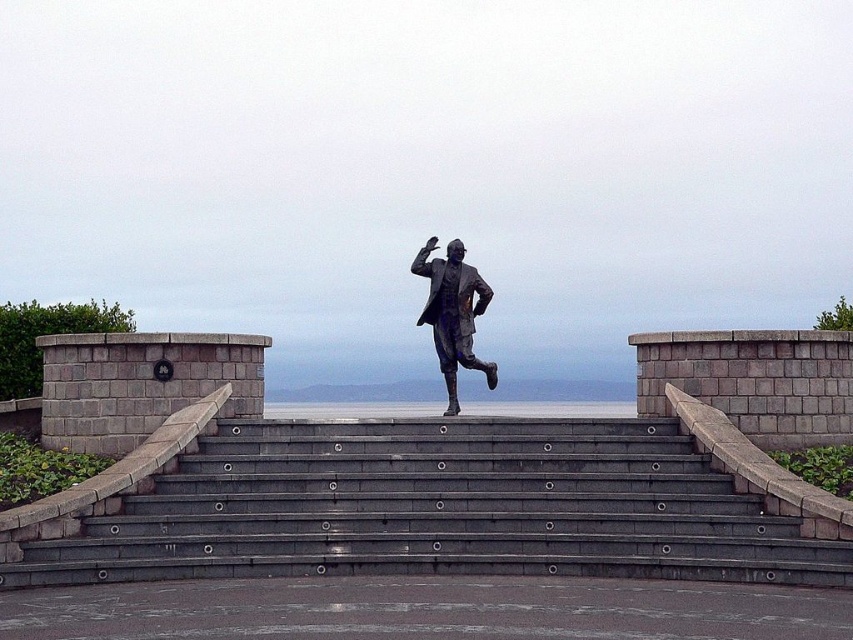
Does gray concrete stairs at center have a greater width compared to bronze statue at center?

Correct, the width of gray concrete stairs at center exceeds that of bronze statue at center.

Who is lower down, gray concrete stairs at center or bronze statue at center?

gray concrete stairs at center is below.

Is point (722, 481) positioned in front of point (463, 301)?

That is True.

Locate an element on the screen. Image resolution: width=853 pixels, height=640 pixels. gray concrete stairs at center is located at coordinates 440,508.